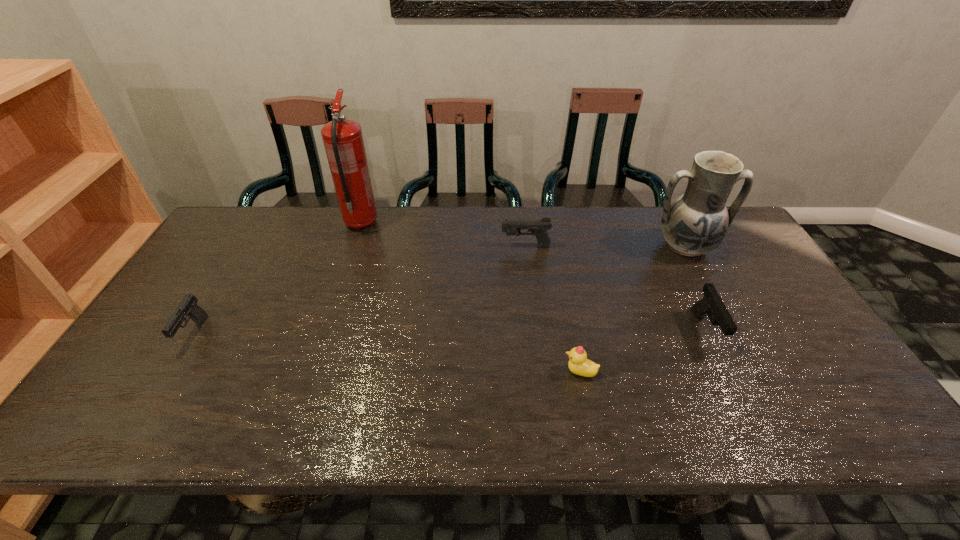
Locate an element on the screen. This screenshot has width=960, height=540. fire extinguisher is located at coordinates (343, 141).

This screenshot has width=960, height=540. What are the coordinates of `the tallest object` in the screenshot? It's located at (343, 141).

The image size is (960, 540). What are the coordinates of `the fifth shortest object` in the screenshot? It's located at (696, 223).

Find the location of a particular element. The height and width of the screenshot is (540, 960). the second pistol from left to right is located at coordinates [538, 227].

Find the location of a particular element. This screenshot has width=960, height=540. the rightmost pistol is located at coordinates (711, 305).

The image size is (960, 540). Identify the location of the leftmost object. (188, 306).

Locate an element on the screen. The image size is (960, 540). the shortest pistol is located at coordinates (188, 306).

The image size is (960, 540). In order to click on duckling in this screenshot , I will do `click(578, 364)`.

Locate an element on the screen. The height and width of the screenshot is (540, 960). free space located on the front-facing side of the second tallest object is located at coordinates (703, 279).

Identify the location of vacant point located at the barrel of the second pistol from left to right. Image resolution: width=960 pixels, height=540 pixels. (401, 246).